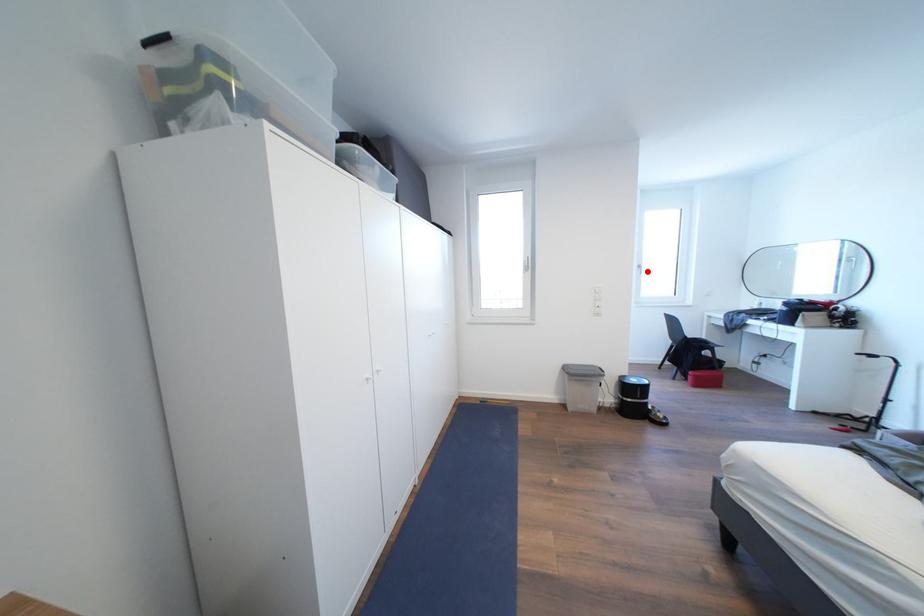
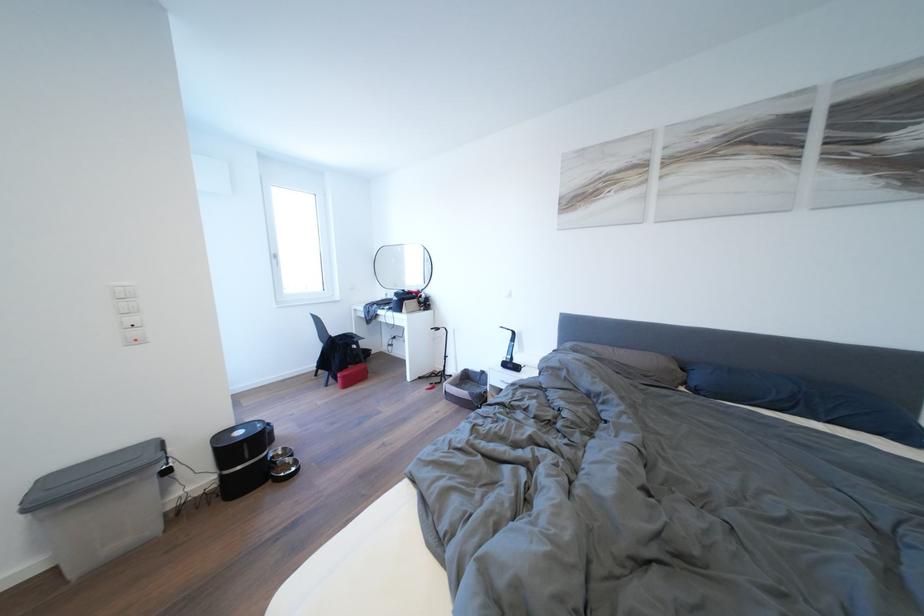
Question: I am providing you with two images of the same scene from different viewpoints. In image1, a red point is highlighted. Considering the same 3D point in image2, which of the following is correct?

Choices:
 (A) It is closer
 (B) It is farther

Answer: (A)